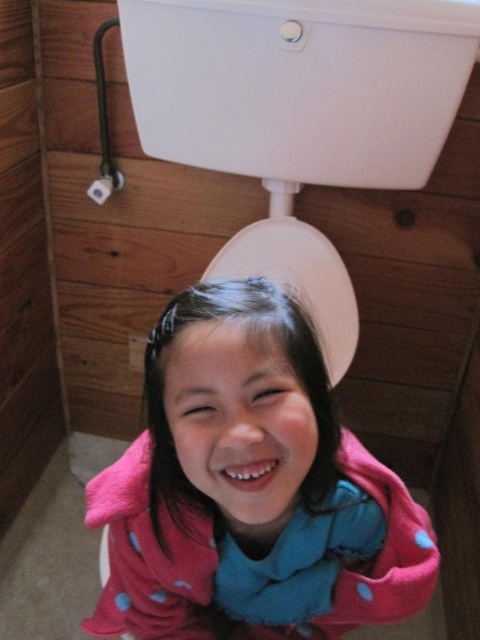
Which is in front, point (136, 58) or point (303, 285)?

Point (136, 58) is more forward.

Does white glossy toilet tank at upper center have a greater height compared to white glossy toilet lid at center?

In fact, white glossy toilet tank at upper center may be shorter than white glossy toilet lid at center.

You are a GUI agent. You are given a task and a screenshot of the screen. Output one action in this format:
    pyautogui.click(x=<x>, y=<y>)
    Task: Click on the white glossy toilet tank at upper center
    
    Given the screenshot: What is the action you would take?
    coord(300,84)

The width and height of the screenshot is (480, 640). What are the coordinates of `white glossy toilet tank at upper center` in the screenshot? It's located at (300, 84).

Is pink polka dot towel at lower center thinner than white glossy toilet lid at center?

Incorrect, pink polka dot towel at lower center's width is not less than white glossy toilet lid at center's.

Which of these two, pink polka dot towel at lower center or white glossy toilet lid at center, stands taller?

pink polka dot towel at lower center

Find the location of a particular element. The width and height of the screenshot is (480, 640). pink polka dot towel at lower center is located at coordinates (251, 490).

Does pink polka dot towel at lower center have a greater height compared to white glossy toilet tank at upper center?

Correct, pink polka dot towel at lower center is much taller as white glossy toilet tank at upper center.

Consider the image. Is pink polka dot towel at lower center positioned before white glossy toilet tank at upper center?

Yes.

Is point (351, 550) more distant than point (144, 93)?

No, (351, 550) is in front of (144, 93).

Where is `pink polka dot towel at lower center`? pink polka dot towel at lower center is located at coordinates (251, 490).